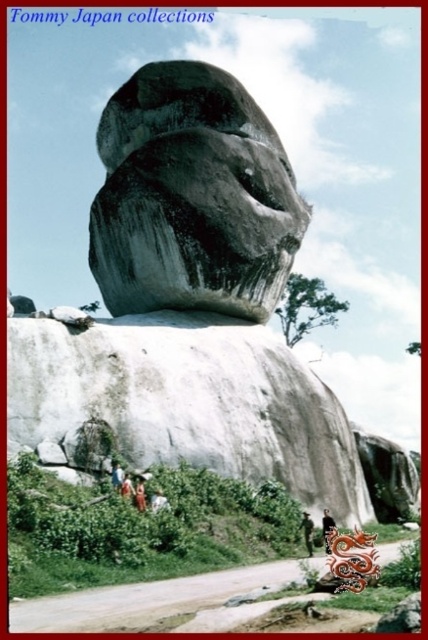
Question: Which point is farther to the camera?

Choices:
 (A) (309, 531)
 (B) (324, 515)
 (C) (309, 520)
 (D) (323, 532)

Answer: (B)

Question: Among these points, which one is nearest to the camera?

Choices:
 (A) (308, 518)
 (B) (323, 509)

Answer: (A)

Question: Does matte gray rock at center have a greater width compared to smooth gray rock at center?

Choices:
 (A) yes
 (B) no

Answer: (B)

Question: Is gray stone sculpture at upper center to the right of smooth gray rock at center from the viewer's perspective?

Choices:
 (A) no
 (B) yes

Answer: (A)

Question: Estimate the real-world distances between objects in this image. Which object is farther from the green fabric shirt at center?

Choices:
 (A) black silk dress at lower center
 (B) matte gray rock at center
 (C) gray stone sculpture at upper center

Answer: (C)

Question: Considering the relative positions of gray stone sculpture at upper center and gray/weathered rock face at center in the image provided, where is gray stone sculpture at upper center located with respect to gray/weathered rock face at center?

Choices:
 (A) left
 (B) right

Answer: (A)